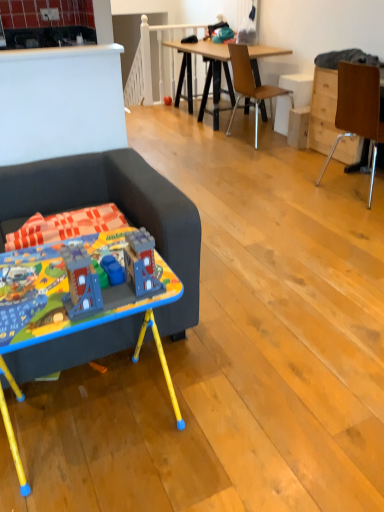
Identify the location of free spot below blue plastic desk at lower left (from a real-world perspective). (84, 417).